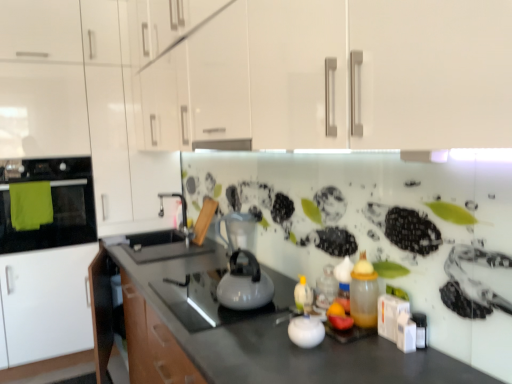
Question: From the image's perspective, is translucent plastic bottle at center-right, positioned as the 2th bottle in back-to-front order, positioned above or below white glossy jar at center, which ranks as the 2th appliance in top-to-bottom order?

Choices:
 (A) below
 (B) above

Answer: (B)

Question: Is point (367, 306) closer or farther from the camera than point (323, 331)?

Choices:
 (A) closer
 (B) farther

Answer: (B)

Question: Which is farther from the white glossy cabinets at upper left?

Choices:
 (A) satin silver kettle at center, the 2th appliance from the right
 (B) white glossy jar at center, the second appliance viewed from the back
 (C) white glossy kettle at center
 (D) green fabric oven at left
 (E) translucent plastic bottle at center, which ranks as the second bottle in front-to-back order

Answer: (B)

Question: Estimate the real-world distances between objects in this image. Which object is closer to the green fabric oven at left?

Choices:
 (A) white glossy jar at center, the second appliance viewed from the left
 (B) white glossy cabinets at upper left
 (C) translucent plastic bottle at center, which is the first bottle in back-to-front order
 (D) white glossy kettle at center
 (E) satin silver kettle at center, the 1th appliance from the top

Answer: (B)